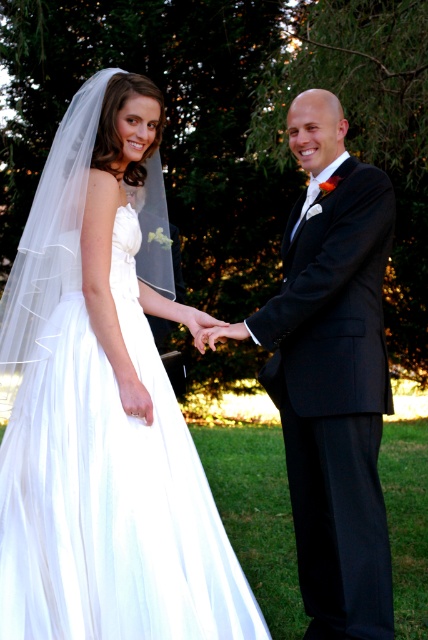
Question: Is white tulle dress at left wider than black satin suit at center?

Choices:
 (A) yes
 (B) no

Answer: (A)

Question: Can you confirm if white tulle dress at left is positioned above black satin suit at center?

Choices:
 (A) yes
 (B) no

Answer: (A)

Question: Can you confirm if white tulle dress at left is bigger than black satin suit at center?

Choices:
 (A) no
 (B) yes

Answer: (B)

Question: Which point is farther to the camera?

Choices:
 (A) (273, 362)
 (B) (201, 499)

Answer: (A)

Question: Which point is closer to the camera?

Choices:
 (A) white tulle dress at left
 (B) black satin suit at center

Answer: (A)